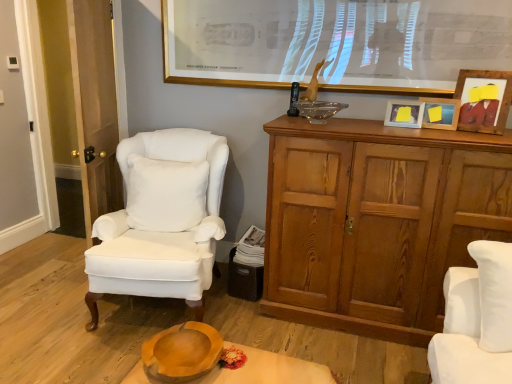
The height and width of the screenshot is (384, 512). I want to click on free point to the left of transparent glass door at left, so click(46, 262).